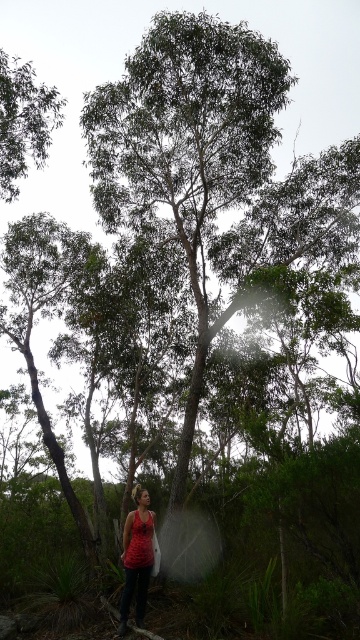
Can you confirm if green leafy tree at upper left is shorter than red fabric tank top at lower center?

In fact, green leafy tree at upper left may be taller than red fabric tank top at lower center.

In the scene shown: Who is more distant from viewer, (18, 83) or (128, 547)?

Point (18, 83)

At what (x,y) coordinates should I click in order to perform the action: click on green leafy tree at upper left. Please return your answer as a coordinate pair (x, y). Looking at the image, I should click on (24, 122).